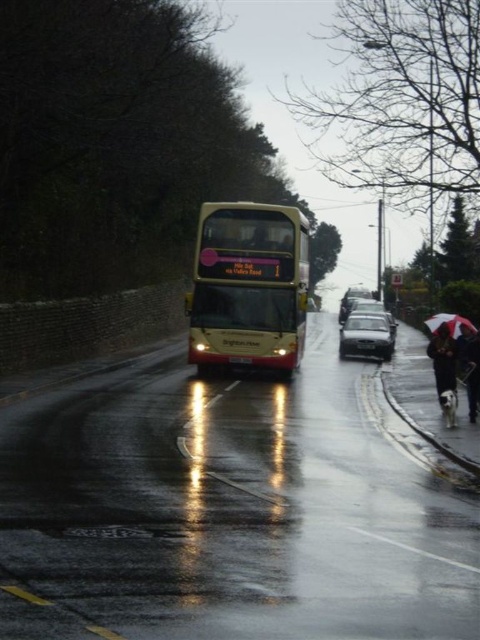
Question: Which of the following is the farthest from the observer?

Choices:
 (A) shiny metallic sedan at center-right
 (B) white umbrella at right
 (C) white fabric umbrella at lower right
 (D) black fabric umbrella at lower right

Answer: (A)

Question: Which point is farther to the camera?

Choices:
 (A) (445, 316)
 (B) (470, 337)
 (C) (446, 337)

Answer: (A)

Question: From the image, what is the correct spatial relationship of shiny metallic sedan at center-right in relation to white umbrella at right?

Choices:
 (A) left
 (B) right

Answer: (B)

Question: Considering the relative positions of gold metallic bus at center and white fabric umbrella at lower right in the image provided, where is gold metallic bus at center located with respect to white fabric umbrella at lower right?

Choices:
 (A) right
 (B) left

Answer: (B)

Question: Does gold metallic bus at center appear over white umbrella at right?

Choices:
 (A) yes
 (B) no

Answer: (A)

Question: Which point is farther to the camera?

Choices:
 (A) (445, 321)
 (B) (433, 355)
 (C) (476, 348)

Answer: (A)